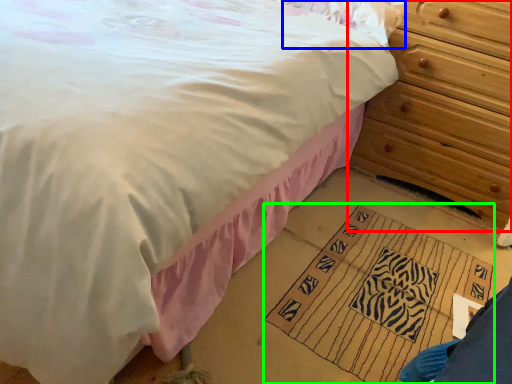
Question: Estimate the real-world distances between objects in this image. Which object is closer to chest of drawers (highlighted by a red box), pillow (highlighted by a blue box) or doormat (highlighted by a green box)?

Choices:
 (A) pillow
 (B) doormat

Answer: (A)